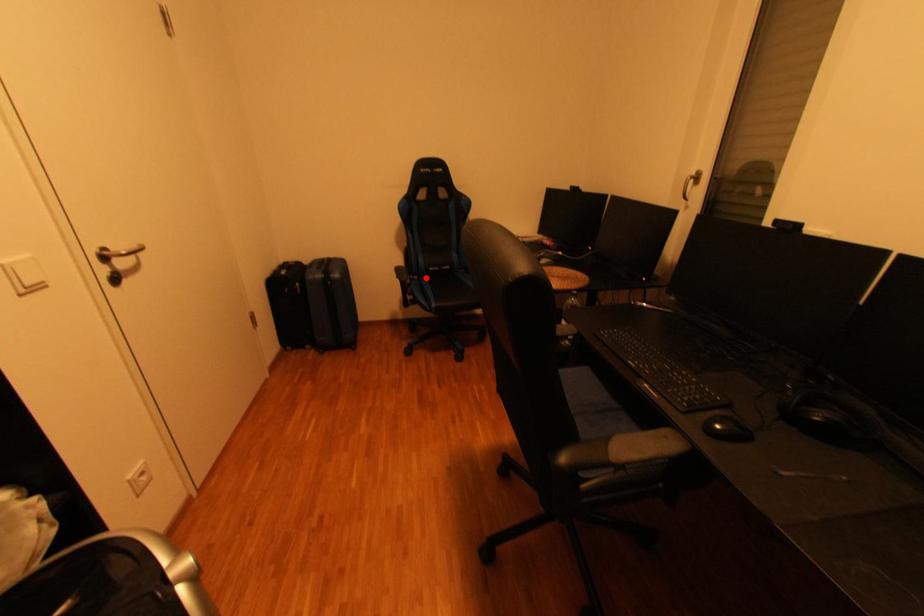
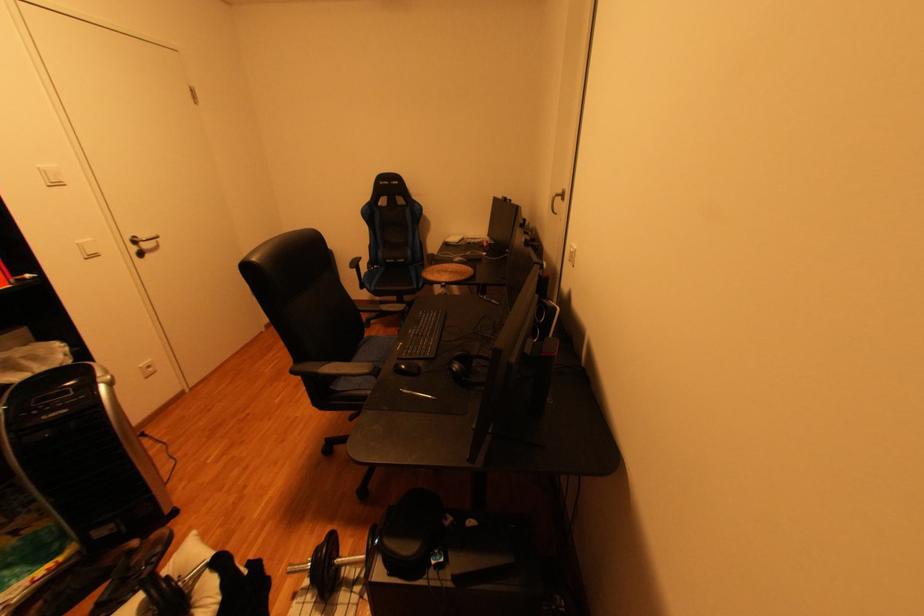
Question: I am providing you with two images of the same scene from different viewpoints. Image1 has a red point marked. In image2, the corresponding 3D location appears at what relative position? Reply with the corresponding letter.

Choices:
 (A) Closer
 (B) Farther

Answer: (A)